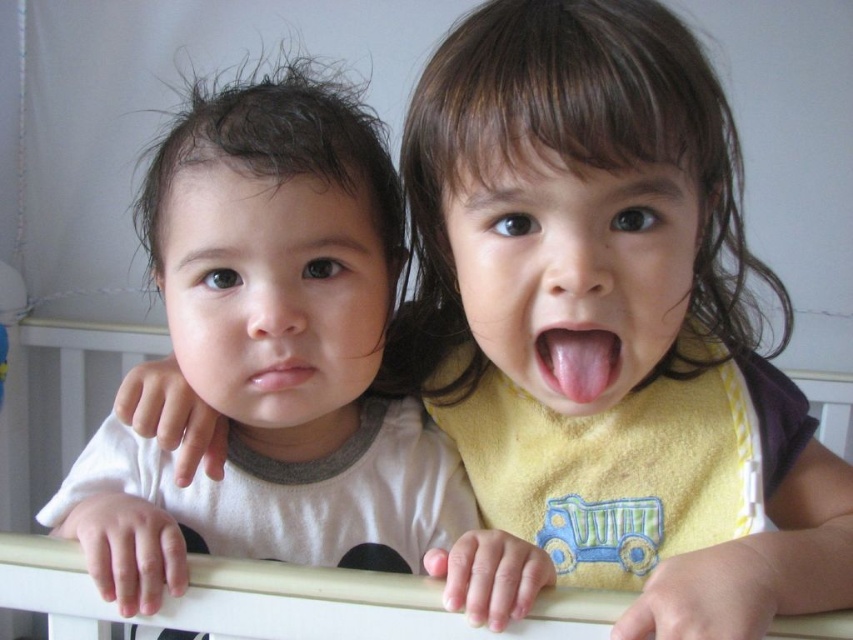
Between yellow soft bib at center and pink flesh tongue at center, which one has less height?

pink flesh tongue at center is shorter.

Is yellow soft bib at center to the left of pink flesh tongue at center from the viewer's perspective?

Incorrect, yellow soft bib at center is not on the left side of pink flesh tongue at center.

Is point (614, 554) more distant than point (596, 401)?

Yes.

Where is `yellow soft bib at center`? yellow soft bib at center is located at coordinates (613, 461).

Can you confirm if white plastic crib at center is positioned above pink flesh tongue at center?

No.

Is white plastic crib at center to the left of pink flesh tongue at center from the viewer's perspective?

Indeed, white plastic crib at center is positioned on the left side of pink flesh tongue at center.

Is point (80, 632) in front of point (575, 337)?

No, (80, 632) is further to viewer.

Identify the location of white plastic crib at center. The height and width of the screenshot is (640, 853). (312, 604).

Between white matte shirt at left and white plastic crib at center, which one is positioned lower?

Positioned lower is white plastic crib at center.

Can you confirm if white matte shirt at left is wider than white plastic crib at center?

Correct, the width of white matte shirt at left exceeds that of white plastic crib at center.

Locate an element on the screen. The height and width of the screenshot is (640, 853). white matte shirt at left is located at coordinates (271, 355).

Identify the location of white matte shirt at left. (271, 355).